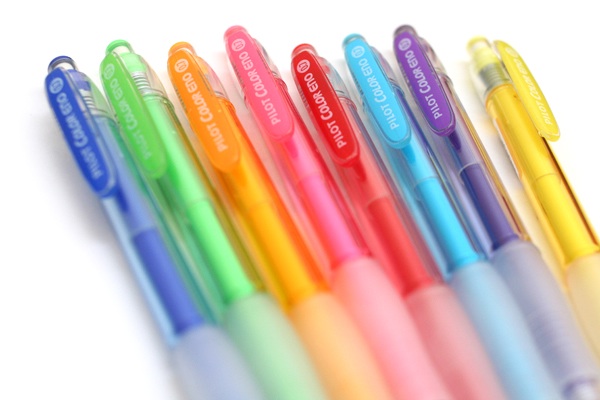
Where is `pens`? The height and width of the screenshot is (400, 600). pens is located at coordinates (171, 262), (228, 243), (260, 236), (326, 219), (372, 213), (426, 200), (479, 190), (550, 169).